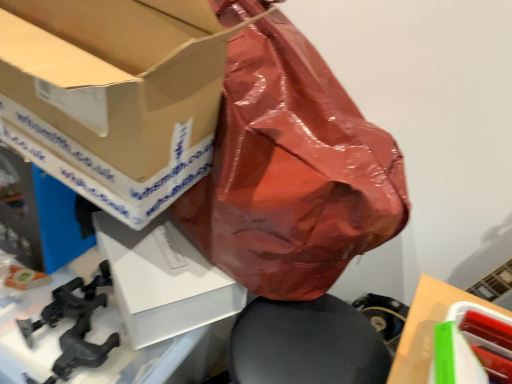
Question: From the image's perspective, would you say black matte clamp at lower left is shown under white matte box at center, arranged as the second box when viewed from the left?

Choices:
 (A) yes
 (B) no

Answer: (A)

Question: From a real-world perspective, is black matte clamp at lower left below white matte box at center, the second box from the right?

Choices:
 (A) yes
 (B) no

Answer: (A)

Question: Are black matte clamp at lower left and white matte box at center, the second box from the right, located far from each other?

Choices:
 (A) yes
 (B) no

Answer: (B)

Question: From the image's perspective, does black matte clamp at lower left appear higher than white matte box at center, the second box from the right?

Choices:
 (A) yes
 (B) no

Answer: (B)

Question: Is black matte clamp at lower left facing away from white matte box at center, the second box from the right?

Choices:
 (A) yes
 (B) no

Answer: (B)

Question: From their relative heights in the image, would you say matte cardboard box at upper left, acting as the first box starting from the left, is taller or shorter than black matte clamp at lower left?

Choices:
 (A) short
 (B) tall

Answer: (B)

Question: Considering the relative positions of matte cardboard box at upper left, acting as the first box starting from the left, and black matte clamp at lower left in the image provided, is matte cardboard box at upper left, acting as the first box starting from the left, to the left or to the right of black matte clamp at lower left?

Choices:
 (A) right
 (B) left

Answer: (B)

Question: In terms of width, does matte cardboard box at upper left, which is the third box from right to left, look wider or thinner when compared to black matte clamp at lower left?

Choices:
 (A) thin
 (B) wide

Answer: (B)

Question: From a real-world perspective, is matte cardboard box at upper left, which is the third box from right to left, above or below black matte clamp at lower left?

Choices:
 (A) below
 (B) above

Answer: (B)

Question: Would you say black matte clamp at lower left is to the left or to the right of matte cardboard box at upper left, which is the third box from right to left, in the picture?

Choices:
 (A) left
 (B) right

Answer: (B)

Question: Considering the positions of point (26, 377) and point (40, 102), is point (26, 377) closer or farther from the camera than point (40, 102)?

Choices:
 (A) farther
 (B) closer

Answer: (A)

Question: Is black matte clamp at lower left bigger or smaller than matte cardboard box at upper left, which is the third box from right to left?

Choices:
 (A) small
 (B) big

Answer: (A)

Question: From a real-world perspective, is black matte clamp at lower left above or below matte cardboard box at upper left, acting as the first box starting from the left?

Choices:
 (A) below
 (B) above

Answer: (A)

Question: In terms of width, does white matte cardboard box at lower right look wider or thinner when compared to white matte box at center, arranged as the second box when viewed from the left?

Choices:
 (A) wide
 (B) thin

Answer: (B)

Question: From a real-world perspective, is white matte cardboard box at lower right physically located above or below white matte box at center, arranged as the second box when viewed from the left?

Choices:
 (A) above
 (B) below

Answer: (A)